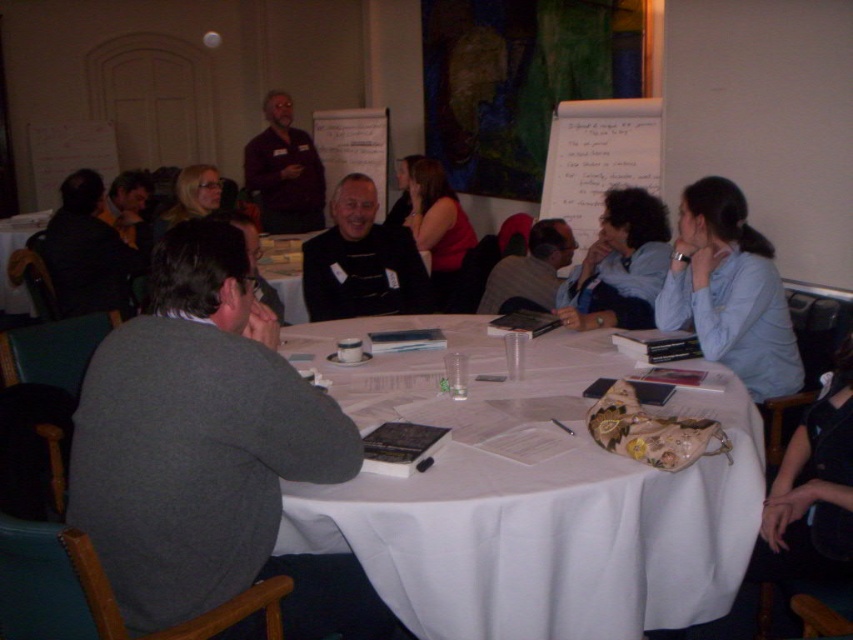
Does light blue shirt at upper right appear on the right side of gray sweater at center?

Indeed, light blue shirt at upper right is positioned on the right side of gray sweater at center.

In the scene shown: Who is lower down, light blue shirt at upper right or gray sweater at center?

light blue shirt at upper right is below.

Is point (730, 336) farther from viewer compared to point (521, 296)?

No.

The image size is (853, 640). What are the coordinates of `light blue shirt at upper right` in the screenshot? It's located at (729, 291).

What do you see at coordinates (619, 266) in the screenshot? The width and height of the screenshot is (853, 640). I see `blue fabric shirt at center` at bounding box center [619, 266].

Who is more distant from viewer, (645, 301) or (318, 188)?

The point (318, 188) is more distant.

What do you see at coordinates (619, 266) in the screenshot? I see `blue fabric shirt at center` at bounding box center [619, 266].

Locate an element on the screen. blue fabric shirt at center is located at coordinates (619, 266).

Which is below, light blue shirt at upper right or blue fabric shirt at center?

light blue shirt at upper right is below.

Between light blue shirt at upper right and blue fabric shirt at center, which one appears on the left side from the viewer's perspective?

Positioned to the left is blue fabric shirt at center.

Where is `light blue shirt at upper right`? light blue shirt at upper right is located at coordinates (729, 291).